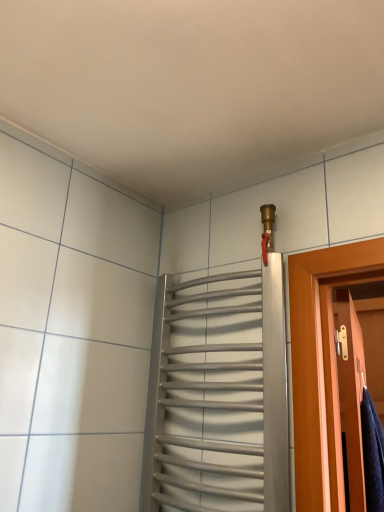
Question: Considering the relative sizes of wooden door at right and silver metallic towel rack at upper center in the image provided, is wooden door at right shorter than silver metallic towel rack at upper center?

Choices:
 (A) yes
 (B) no

Answer: (A)

Question: Is wooden door at right oriented away from silver metallic towel rack at upper center?

Choices:
 (A) yes
 (B) no

Answer: (A)

Question: Does wooden door at right contain silver metallic towel rack at upper center?

Choices:
 (A) yes
 (B) no

Answer: (B)

Question: Can you confirm if wooden door at right is bigger than silver metallic towel rack at upper center?

Choices:
 (A) no
 (B) yes

Answer: (B)

Question: Can you confirm if wooden door at right is smaller than silver metallic towel rack at upper center?

Choices:
 (A) yes
 (B) no

Answer: (B)

Question: From a real-world perspective, is wooden door at right on silver metallic towel rack at upper center?

Choices:
 (A) yes
 (B) no

Answer: (B)

Question: Is silver metallic towel rack at upper center at the left side of wooden door at right?

Choices:
 (A) yes
 (B) no

Answer: (A)

Question: Does silver metallic towel rack at upper center have a greater width compared to wooden door at right?

Choices:
 (A) yes
 (B) no

Answer: (A)

Question: Does silver metallic towel rack at upper center have a greater height compared to wooden door at right?

Choices:
 (A) yes
 (B) no

Answer: (A)

Question: From a real-world perspective, is silver metallic towel rack at upper center below wooden door at right?

Choices:
 (A) no
 (B) yes

Answer: (A)

Question: From the image's perspective, is silver metallic towel rack at upper center under wooden door at right?

Choices:
 (A) yes
 (B) no

Answer: (B)

Question: Could you tell me if silver metallic towel rack at upper center is turned towards wooden door at right?

Choices:
 (A) no
 (B) yes

Answer: (A)

Question: Is wooden door at right situated inside silver metallic towel rack at upper center or outside?

Choices:
 (A) outside
 (B) inside

Answer: (A)